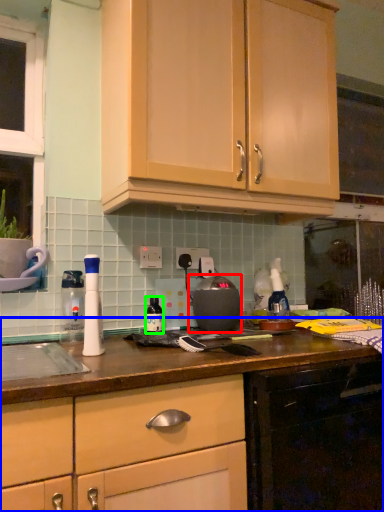
Question: Considering the real-world distances, which object is closest to appliance (highlighted by a red box)? cabinetry (highlighted by a blue box) or bottle (highlighted by a green box).

Choices:
 (A) cabinetry
 (B) bottle

Answer: (B)